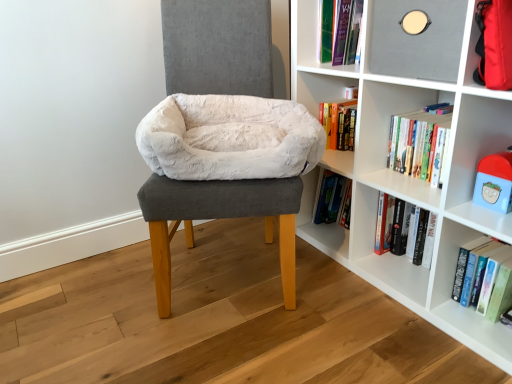
You are a GUI agent. You are given a task and a screenshot of the screen. Output one action in this format:
    pyautogui.click(x=<x>, y=<y>)
    Task: Click on the vacant space situated on the left part of white plush pet bed at center
    
    Given the screenshot: What is the action you would take?
    pyautogui.click(x=98, y=298)